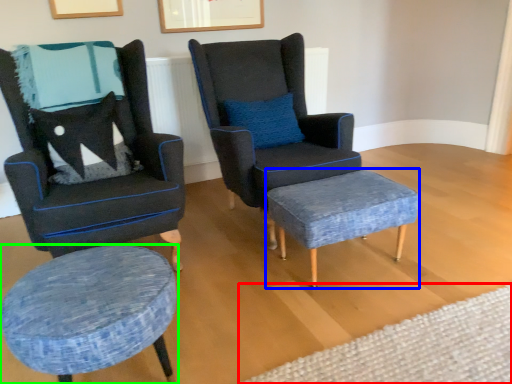
Question: Which object is the closest to the plain (highlighted by a red box)? Choose among these: stool (highlighted by a blue box) or stool (highlighted by a green box).

Choices:
 (A) stool
 (B) stool

Answer: (A)